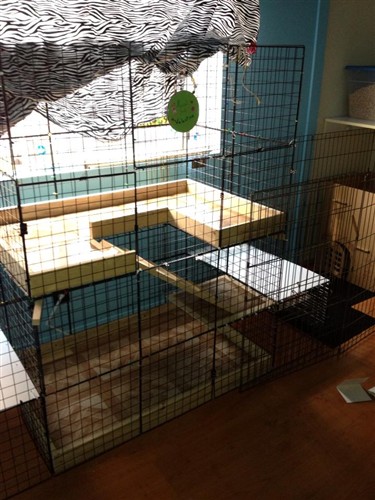
This screenshot has height=500, width=375. What are the coordinates of `box` in the screenshot? It's located at (357, 224).